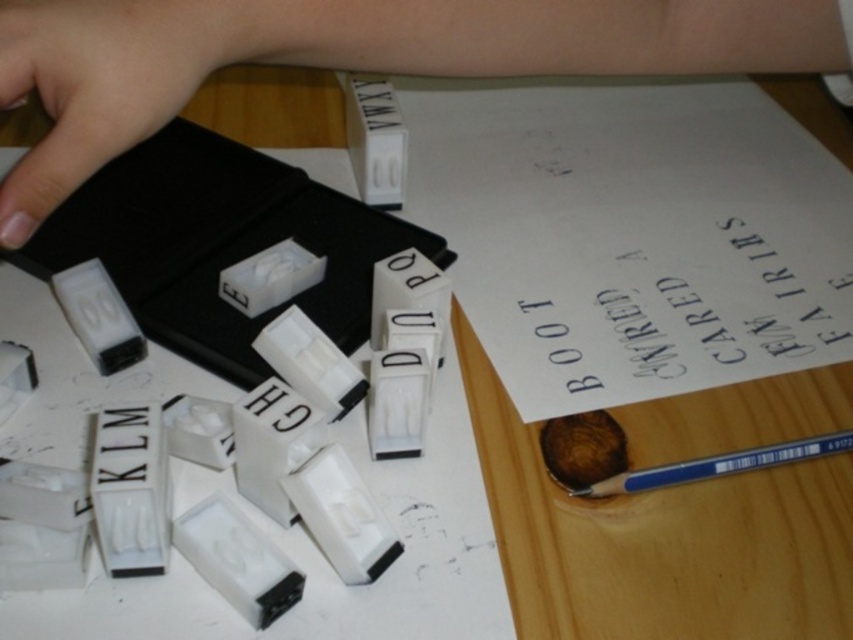
Question: Does pink skin at upper center have a lesser width compared to blue plastic pencil at lower right?

Choices:
 (A) yes
 (B) no

Answer: (B)

Question: Where is pink skin at upper center located in relation to pale skin at upper left in the image?

Choices:
 (A) left
 (B) right

Answer: (B)

Question: Which object appears closest to the camera in this image?

Choices:
 (A) pale skin at upper left
 (B) pink skin at upper center
 (C) blue plastic pencil at lower right

Answer: (A)

Question: Which object appears closest to the camera in this image?

Choices:
 (A) pale skin at upper left
 (B) pink skin at upper center
 (C) blue plastic pencil at lower right

Answer: (A)

Question: Does pink skin at upper center appear on the right side of blue plastic pencil at lower right?

Choices:
 (A) yes
 (B) no

Answer: (B)

Question: Which object is positioned closest to the pink skin at upper center?

Choices:
 (A) pale skin at upper left
 (B) blue plastic pencil at lower right

Answer: (A)